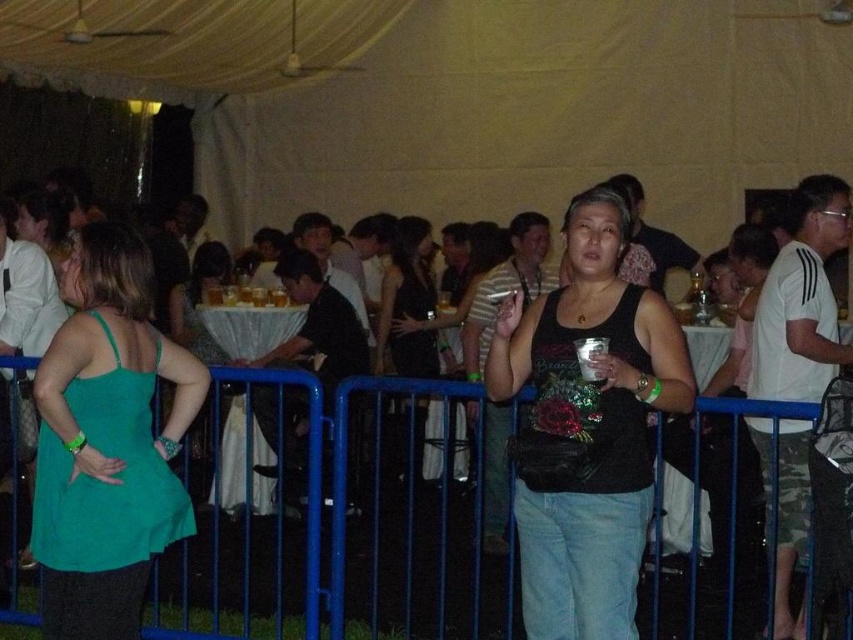
You are at a social event under a large tent and see a person wearing a black matte tank top at center. Where exactly is this person located in the tent?

The black matte tank top at center is located at point 0.669 on the x axis and 0.688 on the y axis.

You are a photographer at the event and want to take a photo of the black matte tank top at center and the blue metal fence at center. Which object should you focus on first if you want to capture both in the frame without moving the camera?

The black matte tank top at center is much taller than the blue metal fence at center, so you should focus on the black matte tank top at center first to ensure it is fully captured in the frame.